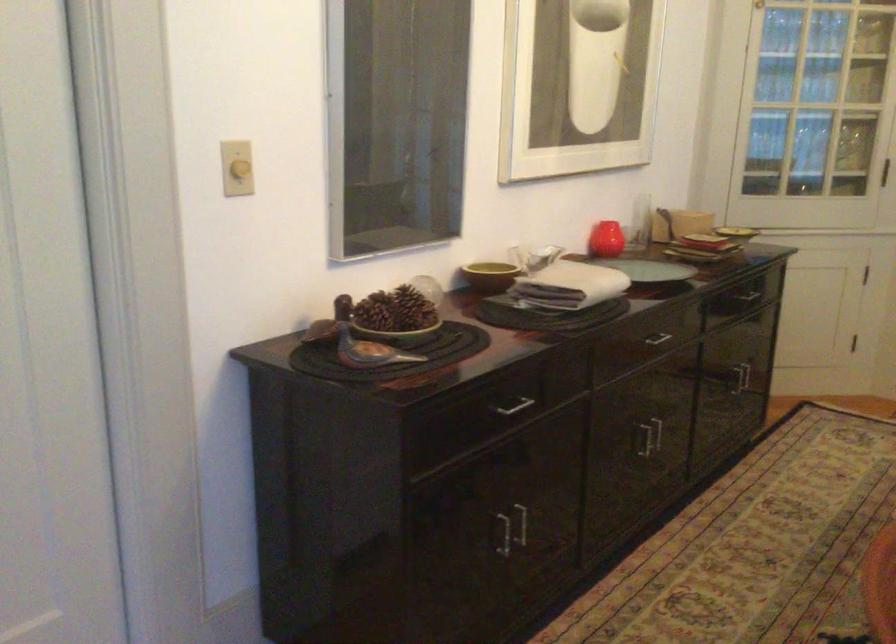
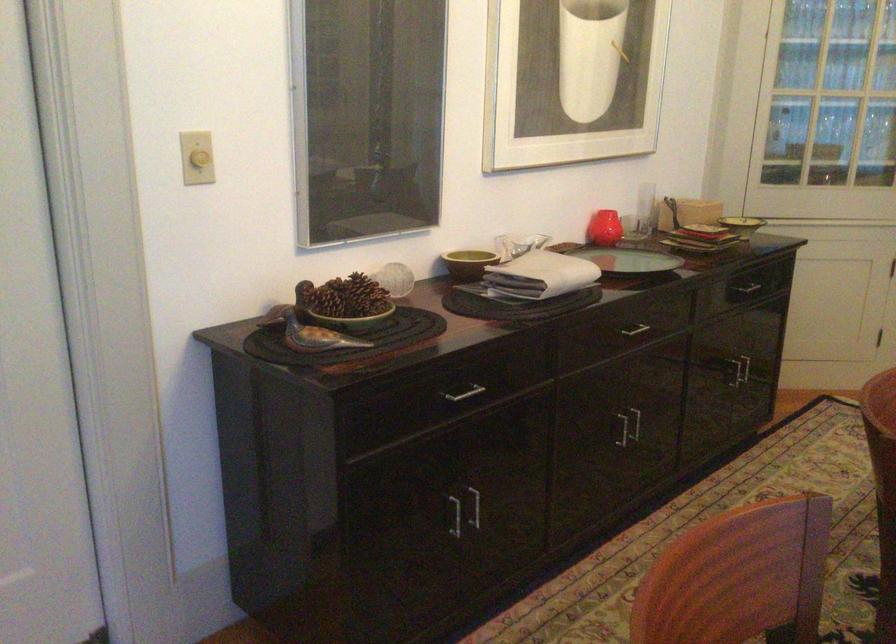
Locate, in the second image, the point that corresponds to the point at 492,276 in the first image.

(468, 263)